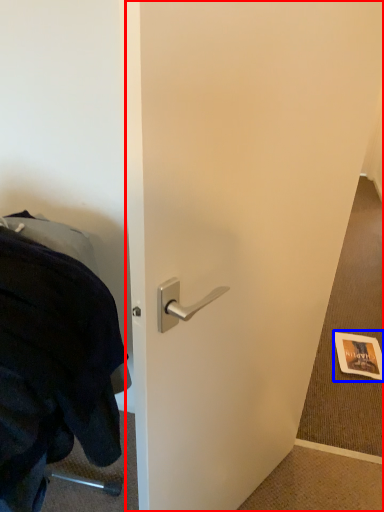
Question: Which object is closer to the camera taking this photo, door (highlighted by a red box) or postcard (highlighted by a blue box)?

Choices:
 (A) door
 (B) postcard

Answer: (A)